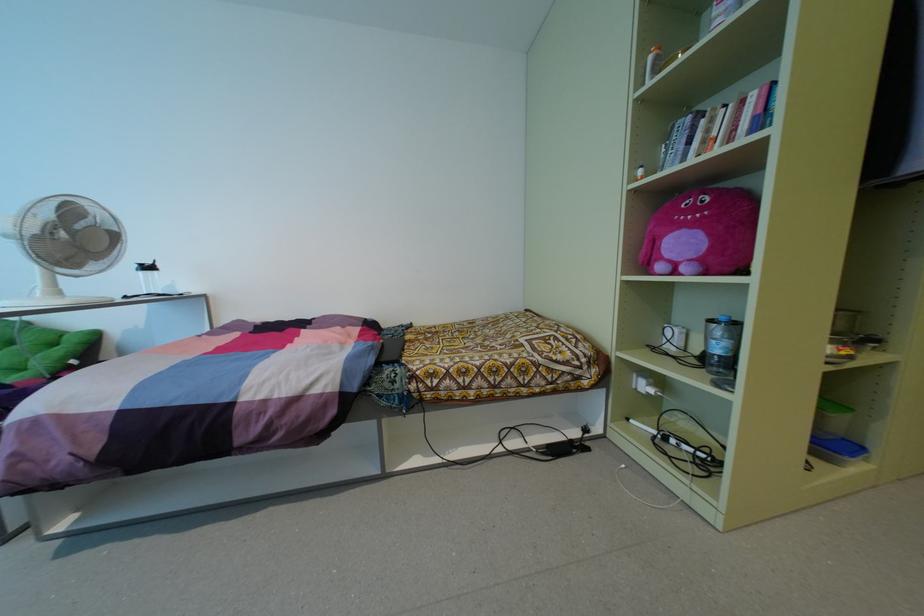
The width and height of the screenshot is (924, 616). Identify the location of pink stuffed toy. (701, 233).